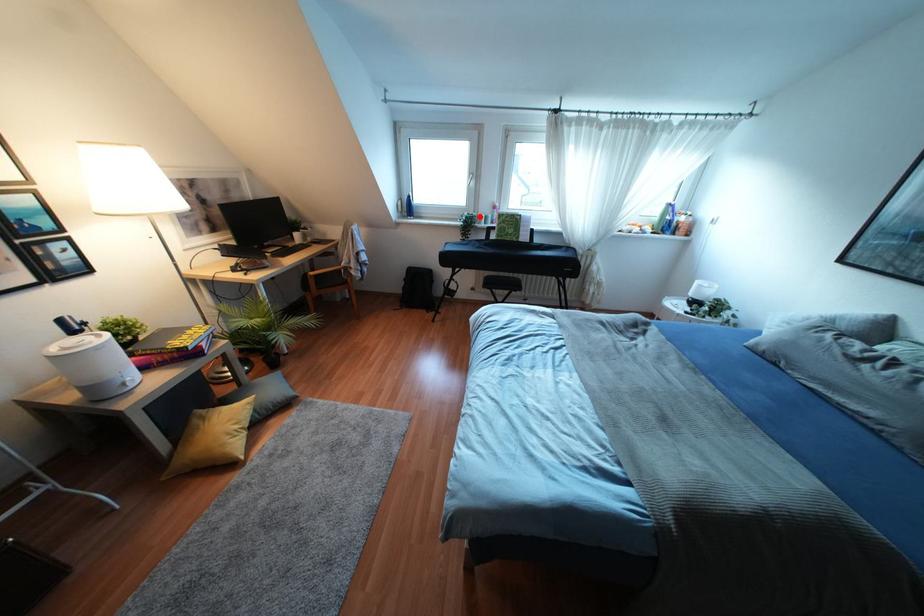
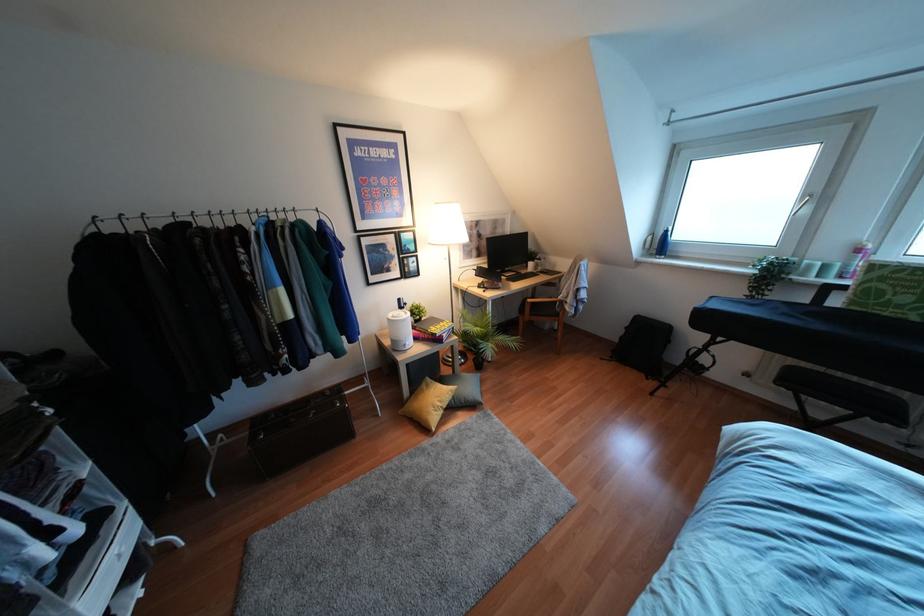
Question: I am providing you with two images of the same scene from different viewpoints. A red point is shown in image1. For the corresponding object point in image2, is it positioned nearer or farther from the camera?

Choices:
 (A) Nearer
 (B) Farther

Answer: (B)